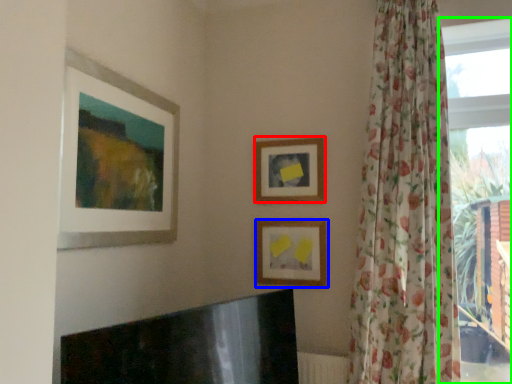
Question: Which object is the farthest from picture frame (highlighted by a red box)? Choose among these: picture frame (highlighted by a blue box) or window (highlighted by a green box).

Choices:
 (A) picture frame
 (B) window

Answer: (B)